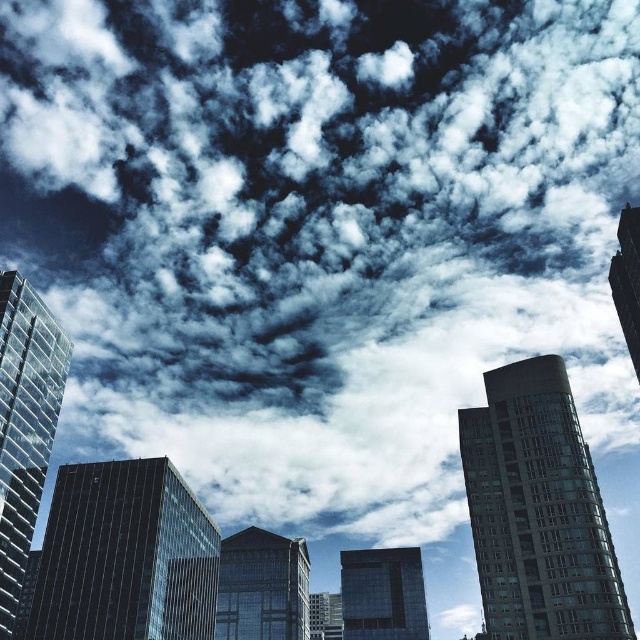
Between black glass building at center and smooth glass skyscraper at upper right, which one has less height?

smooth glass skyscraper at upper right

Where is `black glass building at center`? black glass building at center is located at coordinates (125, 556).

Does black glass building at center appear over glassy reflective skyscraper at center?

Yes, black glass building at center is above glassy reflective skyscraper at center.

Between point (189, 525) and point (291, 632), which one is positioned behind?

The point (291, 632) is more distant.

Is point (60, 468) farther from viewer compared to point (234, 598)?

No, (60, 468) is closer to viewer.

I want to click on black glass building at center, so click(125, 556).

Is glassy reflective tower at center behind smooth glass skyscraper at upper right?

No.

Who is higher up, glassy reflective tower at center or smooth glass skyscraper at upper right?

smooth glass skyscraper at upper right

Does point (602, 634) come closer to viewer compared to point (621, 324)?

Yes.

At what (x,y) coordinates should I click in order to perform the action: click on glassy reflective tower at center. Please return your answer as a coordinate pair (x, y). Image resolution: width=640 pixels, height=640 pixels. Looking at the image, I should click on (538, 512).